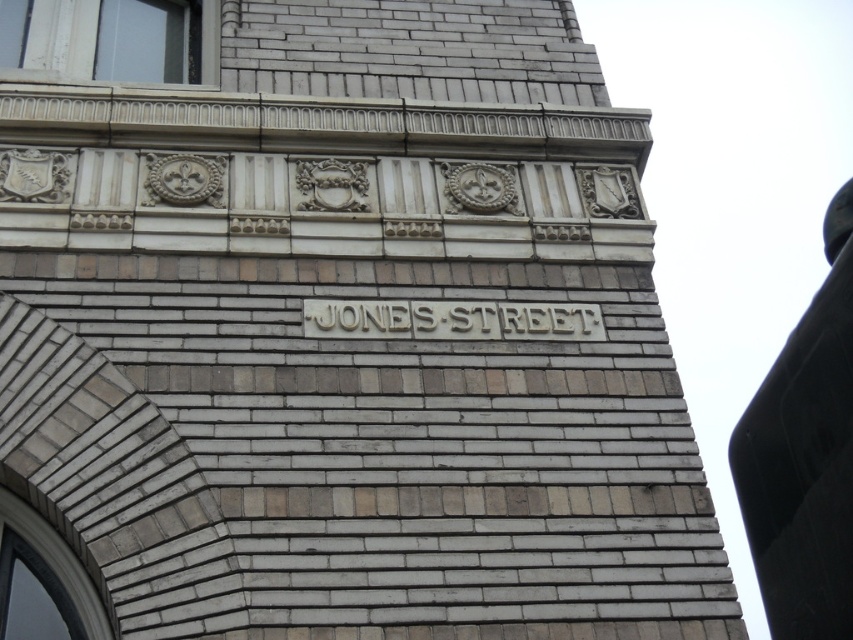
You are a delivery person approaching the building and need to read both the black glossy sign at upper center and the carved stone jones street sign at center. Which sign should you look at first to get closer to the building?

The black glossy sign at upper center is closer to the viewer than the carved stone jones street sign at center, so you should look at the black glossy sign at upper center first as you approach the building.

Based on the photo, you are a delivery person trying to locate the correct address on a building wall. You see the black glossy sign at upper center and the carved stone jones street sign at center. Which sign is positioned to the right of the other?

The black glossy sign at upper center is to the right of the carved stone jones street sign at center.

You are a city planner reviewing the architectural plans for a new building. The design includes a black glossy sign at upper center and a carved stone Jones Street sign at center. According to the design specifications, which sign has a greater width?

The black glossy sign at upper center has a greater width than the carved stone Jones Street sign at center.